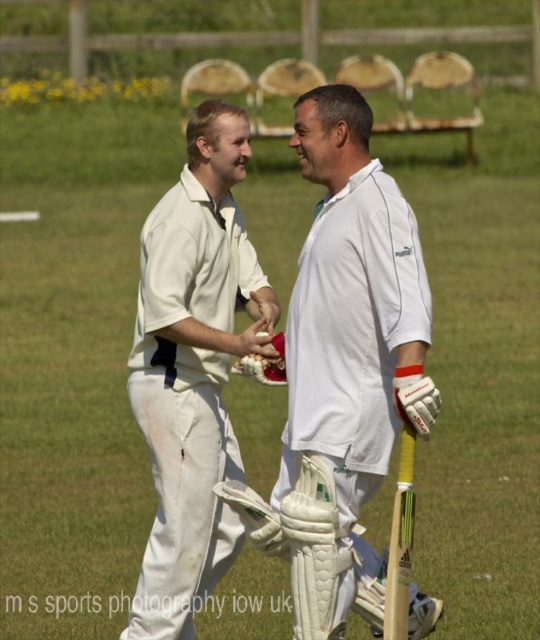
Question: Which point appears closest to the camera in this image?

Choices:
 (A) (266, 385)
 (B) (370, 371)
 (C) (200, 531)

Answer: (B)

Question: Which of the following is the closest to the observer?

Choices:
 (A) (171, 524)
 (B) (313, 150)
 (C) (259, 365)

Answer: (B)

Question: Which object is the farthest from the white cloth shirt at center?

Choices:
 (A) white matte cricket bat at center
 (B) white leather baseball glove at center

Answer: (A)

Question: Does white cloth shirt at center have a smaller size compared to white leather baseball glove at center?

Choices:
 (A) yes
 (B) no

Answer: (B)

Question: Does white matte cricket bat at center come behind white leather baseball glove at center?

Choices:
 (A) yes
 (B) no

Answer: (B)

Question: Can you confirm if white matte cricket bat at center is bigger than white leather baseball glove at center?

Choices:
 (A) yes
 (B) no

Answer: (A)